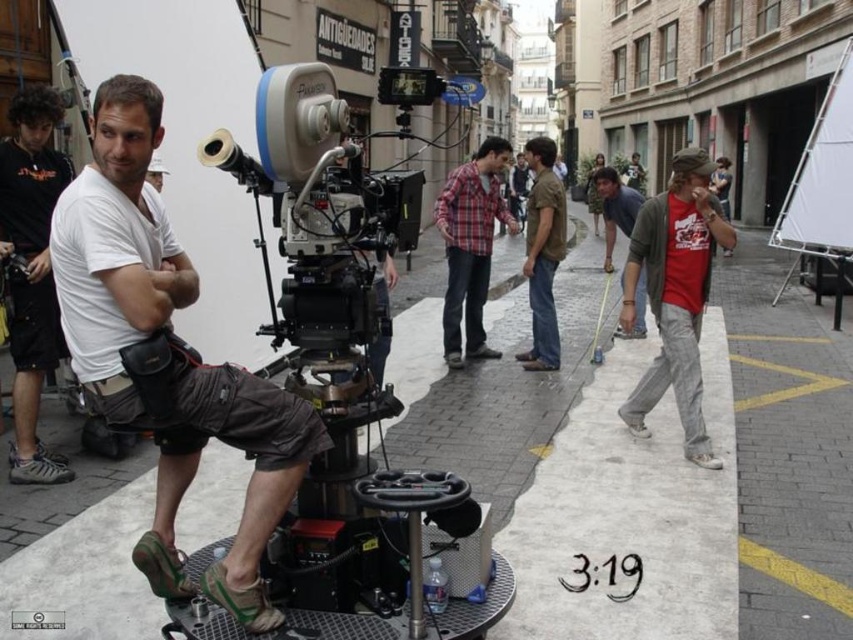
You are a film crew member who needs to place a new camera lens on the ground near the point where the white cotton shirt at center is located. However, there is a strict rule that the lens cannot be placed within 0.2 units of any object. Is the area around point (165, 355) safe to place the lens?

The white cotton shirt at center is located at point (165, 355). Since the lens cannot be placed within 0.2 units of any object, and the shirt is exactly at that point, placing the lens there would violate the rule. Therefore, the area around point (165, 355) is not safe to place the lens.